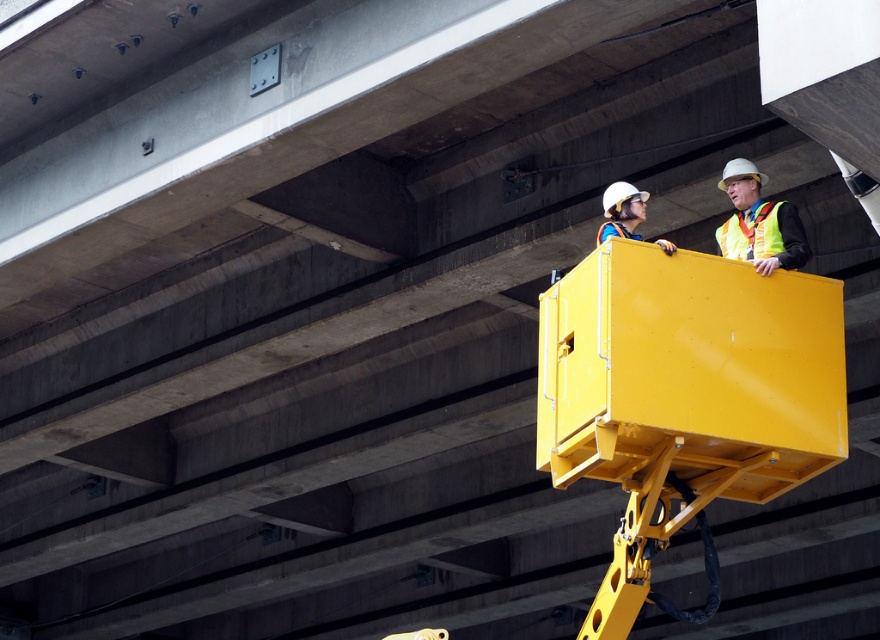
Question: Which of the following is the closest to the observer?

Choices:
 (A) (797, 264)
 (B) (617, 221)

Answer: (A)

Question: Where is yellow reflective vest at upper right located in relation to white hard hat at upper center in the image?

Choices:
 (A) above
 (B) below

Answer: (A)

Question: Can you confirm if yellow reflective vest at upper right is bigger than white hard hat at upper center?

Choices:
 (A) yes
 (B) no

Answer: (A)

Question: Among these points, which one is farthest from the camera?

Choices:
 (A) (744, 163)
 (B) (605, 211)

Answer: (A)

Question: Can you confirm if yellow reflective vest at upper right is smaller than white hard hat at upper center?

Choices:
 (A) yes
 (B) no

Answer: (B)